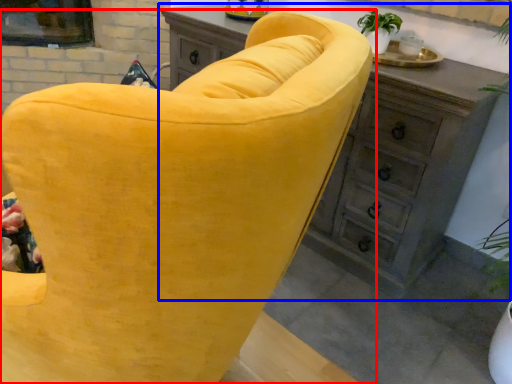
Question: Which object appears farthest to the camera in this image, chair (highlighted by a red box) or chest of drawers (highlighted by a blue box)?

Choices:
 (A) chair
 (B) chest of drawers

Answer: (B)